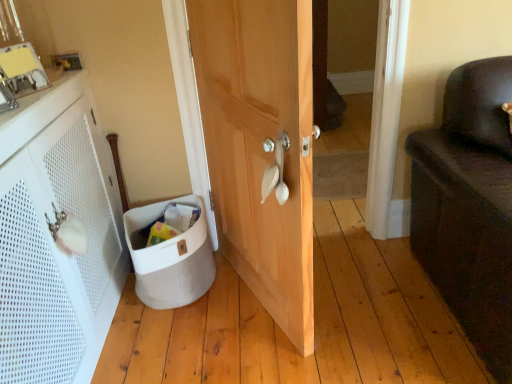
Question: Could you tell me if white fabric laundry basket at lower left is turned towards natural wood door at center?

Choices:
 (A) yes
 (B) no

Answer: (B)

Question: From the image's perspective, does white fabric laundry basket at lower left appear lower than natural wood door at center?

Choices:
 (A) no
 (B) yes

Answer: (B)

Question: Is natural wood door at center a part of white fabric laundry basket at lower left?

Choices:
 (A) yes
 (B) no

Answer: (B)

Question: From a real-world perspective, is white fabric laundry basket at lower left physically above natural wood door at center?

Choices:
 (A) no
 (B) yes

Answer: (A)

Question: Considering the relative sizes of white fabric laundry basket at lower left and natural wood door at center in the image provided, is white fabric laundry basket at lower left bigger than natural wood door at center?

Choices:
 (A) no
 (B) yes

Answer: (A)

Question: Is point (2, 188) closer or farther from the camera than point (278, 139)?

Choices:
 (A) closer
 (B) farther

Answer: (A)

Question: From the image's perspective, is white perforated cabinet at left above or below white plastic door handle at center?

Choices:
 (A) below
 (B) above

Answer: (A)

Question: Based on their sizes in the image, would you say white perforated cabinet at left is bigger or smaller than white plastic door handle at center?

Choices:
 (A) big
 (B) small

Answer: (A)

Question: Considering the positions of white perforated cabinet at left and white plastic door handle at center in the image, is white perforated cabinet at left wider or thinner than white plastic door handle at center?

Choices:
 (A) wide
 (B) thin

Answer: (A)

Question: Is white perforated cabinet at left wider or thinner than white fabric laundry basket at lower left?

Choices:
 (A) thin
 (B) wide

Answer: (A)

Question: Is white perforated cabinet at left to the left or to the right of white fabric laundry basket at lower left in the image?

Choices:
 (A) right
 (B) left

Answer: (B)

Question: Relative to white fabric laundry basket at lower left, is white perforated cabinet at left in front or behind?

Choices:
 (A) behind
 (B) front

Answer: (B)

Question: Is point (108, 183) positioned closer to the camera than point (188, 286)?

Choices:
 (A) closer
 (B) farther

Answer: (B)

Question: Is natural wood door at center wider or thinner than white fabric laundry basket at lower left?

Choices:
 (A) thin
 (B) wide

Answer: (A)

Question: Based on their positions, is natural wood door at center located to the left or right of white fabric laundry basket at lower left?

Choices:
 (A) right
 (B) left

Answer: (A)